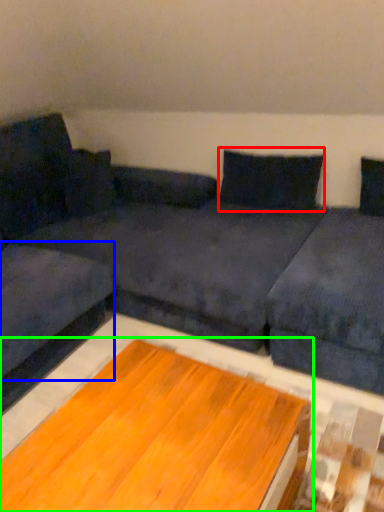
Question: Which is nearer to the pillow (highlighted by a red box)? couch (highlighted by a blue box) or table (highlighted by a green box).

Choices:
 (A) couch
 (B) table

Answer: (A)